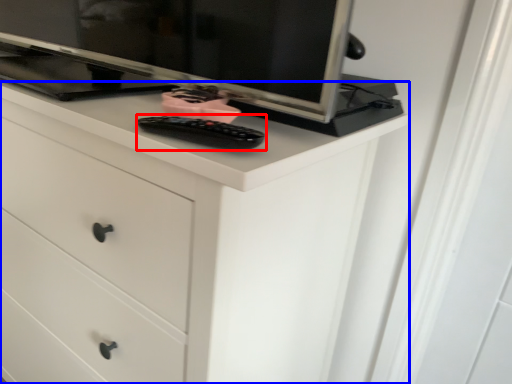
Question: Which object appears closest to the camera in this image, control (highlighted by a red box) or chest of drawers (highlighted by a blue box)?

Choices:
 (A) control
 (B) chest of drawers

Answer: (B)